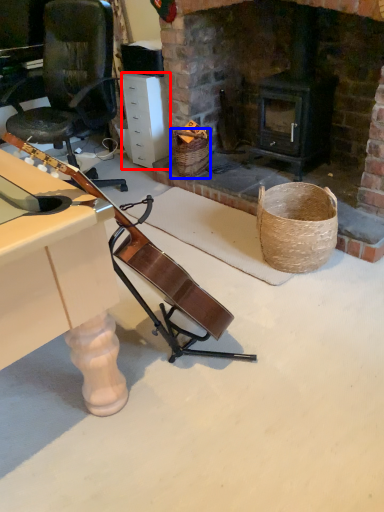
Question: Which object is closer to the camera taking this photo, drawer (highlighted by a red box) or basket (highlighted by a blue box)?

Choices:
 (A) drawer
 (B) basket

Answer: (B)